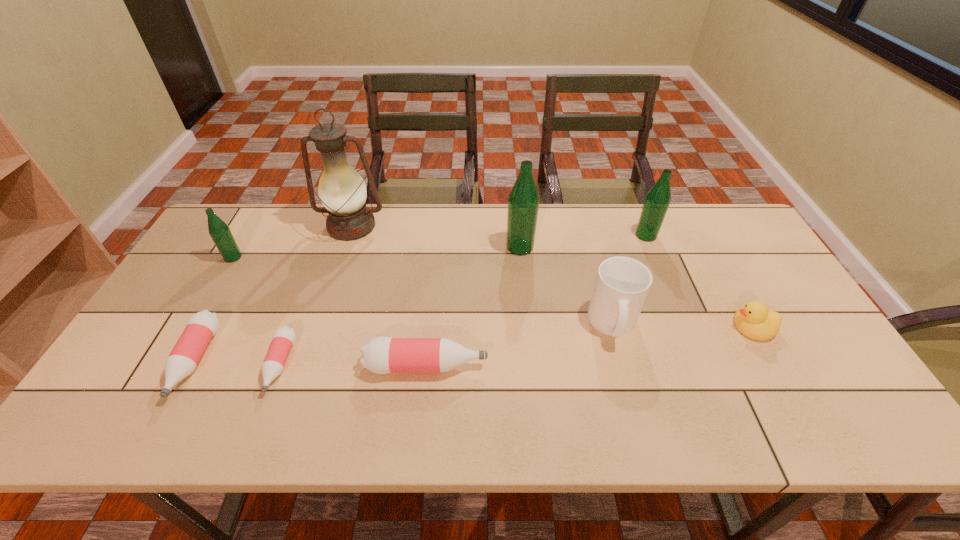
The height and width of the screenshot is (540, 960). In order to click on object at the near left corner in this screenshot , I will do coord(202,326).

This screenshot has height=540, width=960. In the image, there is a desktop. Find the location of `free space at the far edge`. free space at the far edge is located at coordinates (262, 248).

This screenshot has width=960, height=540. In the image, there is a desktop. What are the coordinates of `vacant space at the near edge` in the screenshot? It's located at (674, 417).

In the image, there is a desktop. Where is `blank space at the left edge`? blank space at the left edge is located at coordinates (151, 372).

In the image, there is a desktop. Where is `blank space at the right edge`? blank space at the right edge is located at coordinates [x=790, y=307].

Find the location of a particular element. This screenshot has height=540, width=960. blank space at the far right corner is located at coordinates (716, 238).

At what (x,y) coordinates should I click in order to perform the action: click on free space that is in between the oil lamp and the shortest bottle. Please return your answer as a coordinate pair (x, y). This screenshot has width=960, height=540. Looking at the image, I should click on (316, 295).

Where is `vacant region between the smallest green bottle and the second bottle from right to left`? This screenshot has height=540, width=960. vacant region between the smallest green bottle and the second bottle from right to left is located at coordinates (376, 252).

What are the coordinates of `vacant area that lies between the smallest pink bottle and the leftmost green bottle` in the screenshot? It's located at (256, 311).

Where is `vacant area that lies between the biggest green bottle and the fifth object from left to right`? vacant area that lies between the biggest green bottle and the fifth object from left to right is located at coordinates (473, 306).